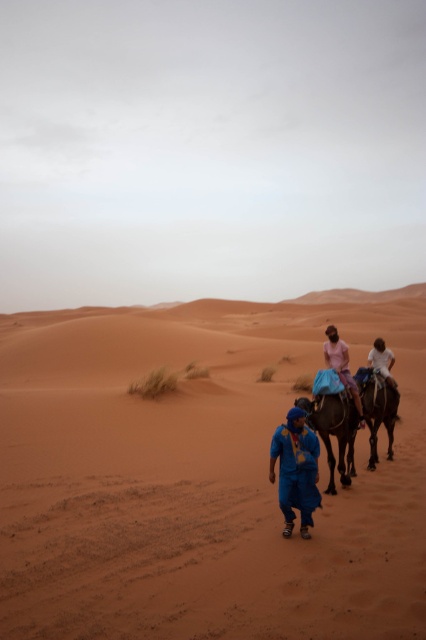
You are a photographer trying to capture the brown textured camel at center and the light pink fabric at center in the same frame. Based on their sizes, do you think you can fit both objects in your camera view without zooming in?

The brown textured camel at center might be wider than light pink fabric at center, so there is a possibility that the camel occupies more space in the frame, but since both are at the same central position, you can likely include both without zooming in by adjusting the camera angle or position to accommodate their widths.

You are a photographer planning to capture a landscape photo of the desert scene. You want to ensure both the brown textured camel at center and the white matte shirt at center are clearly visible in the frame. Given their sizes, which object should you focus on to ensure both are in focus?

The brown textured camel at center is bigger than the white matte shirt at center, so focusing on the larger object, the brown textured camel at center, will help ensure both are in focus as the depth of field will cover the smaller object as well.